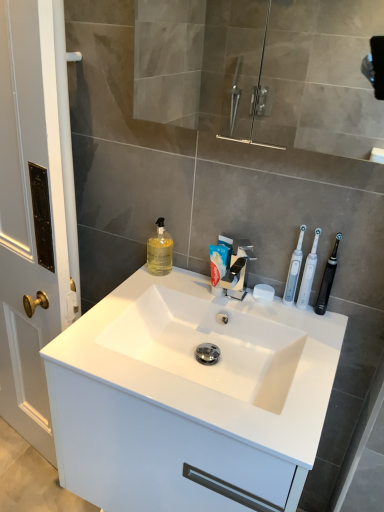
I want to click on free point to the left of white plastic toothbrushes at right, which is the 1th toothbrush in left-to-right order, so click(235, 300).